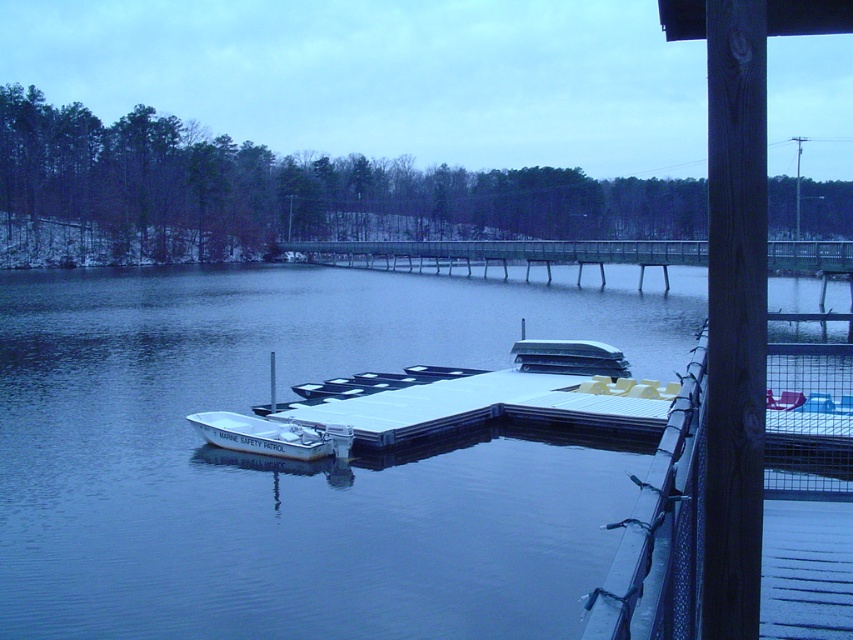
You are standing on the dock and see a point labeled as point (296, 461). What is located at that point?

The point (296, 461) corresponds to blue water at center.

You are standing on the dock and see the blue water at center and the white matte boat at lower left. Which object is located higher in the image?

The blue water at center is above the white matte boat at lower left, so the blue water at center is higher in the image.